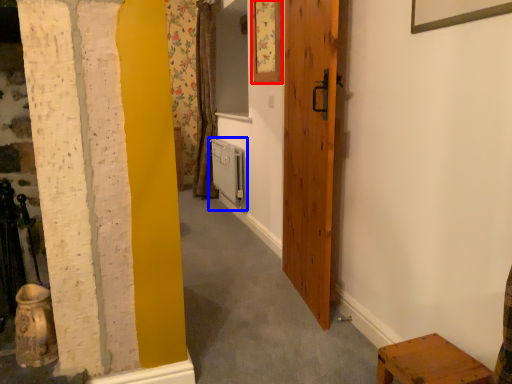
Question: Which of the following is the closest to the observer, picture frame (highlighted by a red box) or radiator (highlighted by a blue box)?

Choices:
 (A) picture frame
 (B) radiator

Answer: (A)